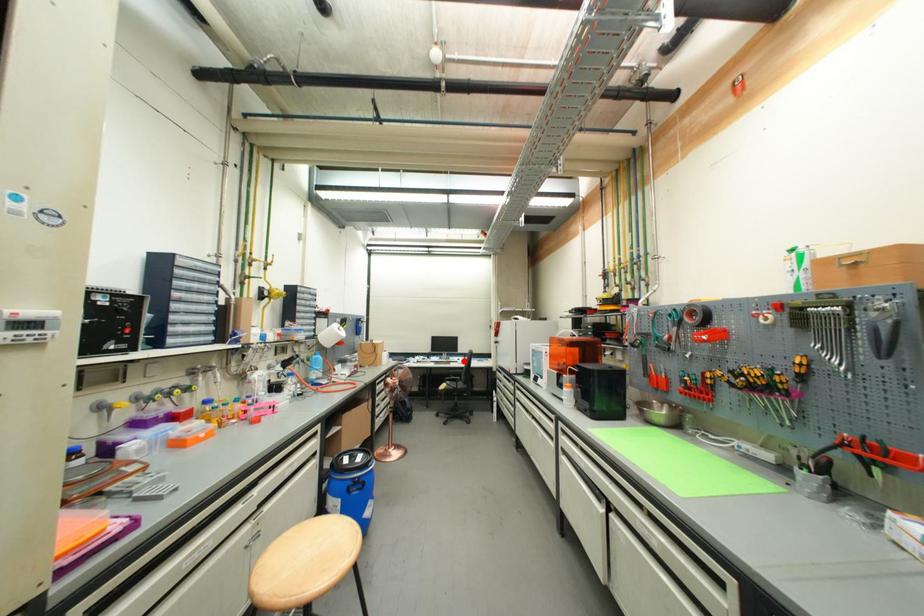
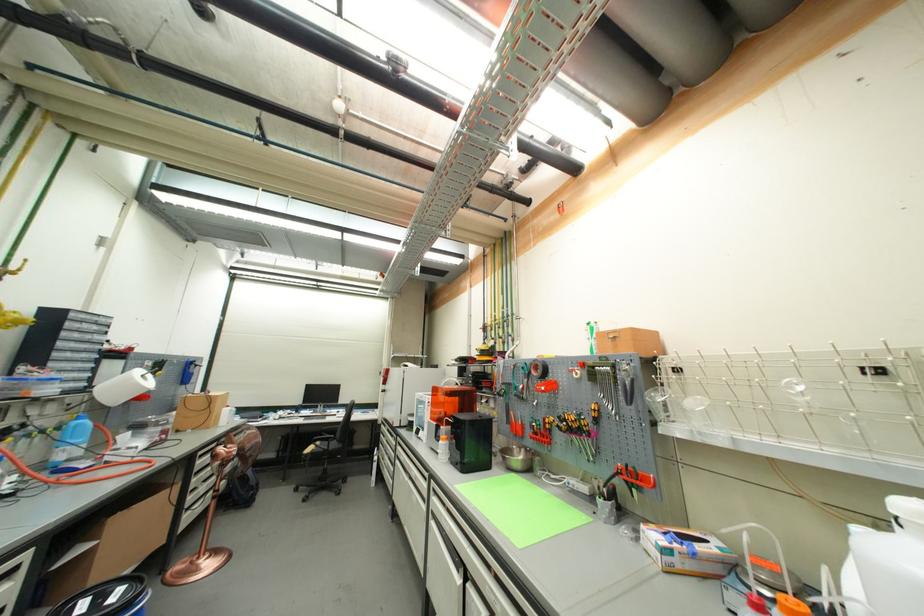
In the second image, find the point that corresponds to the highlighted location in the first image.

(344, 413)